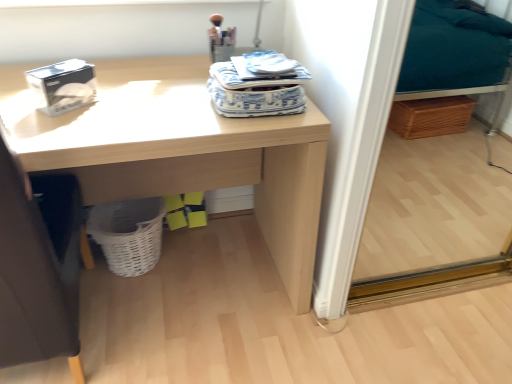
Find the location of a particular element. vacant space that's between white woven basket at lower left and yellow matte box at lower center, marked as the second box in a top-to-bottom arrangement is located at coordinates (186, 241).